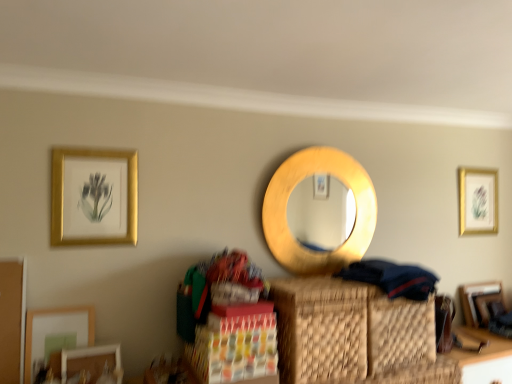
Question: Does dark blue fabric at lower right have a lesser width compared to woven brown basket at center?

Choices:
 (A) no
 (B) yes

Answer: (A)

Question: Considering the relative sizes of dark blue fabric at lower right and woven brown basket at center in the image provided, is dark blue fabric at lower right shorter than woven brown basket at center?

Choices:
 (A) no
 (B) yes

Answer: (B)

Question: From the image's perspective, does dark blue fabric at lower right appear lower than woven brown basket at center?

Choices:
 (A) no
 (B) yes

Answer: (A)

Question: Can woven brown basket at center be found inside dark blue fabric at lower right?

Choices:
 (A) yes
 (B) no

Answer: (B)

Question: Can you confirm if dark blue fabric at lower right is taller than woven brown basket at center?

Choices:
 (A) yes
 (B) no

Answer: (B)

Question: Is dark blue fabric at lower right looking in the opposite direction of woven brown basket at center?

Choices:
 (A) yes
 (B) no

Answer: (B)

Question: From a real-world perspective, is wooden table at lower right physically above matte gold picture frame at lower left, the second picture frame positioned from the front?

Choices:
 (A) no
 (B) yes

Answer: (A)

Question: Is wooden table at lower right wider than matte gold picture frame at lower left, the fourth picture frame when ordered from back to front?

Choices:
 (A) yes
 (B) no

Answer: (A)

Question: From the image's perspective, is wooden table at lower right above matte gold picture frame at lower left, the 5th picture frame positioned from the right?

Choices:
 (A) no
 (B) yes

Answer: (A)

Question: Are wooden table at lower right and matte gold picture frame at lower left, the second picture frame positioned from the front, beside each other?

Choices:
 (A) yes
 (B) no

Answer: (B)

Question: Can you confirm if wooden table at lower right is bigger than matte gold picture frame at lower left, which is the first picture frame in left-to-right order?

Choices:
 (A) no
 (B) yes

Answer: (B)

Question: From the image's perspective, is wooden table at lower right located beneath matte gold picture frame at lower left, the 5th picture frame positioned from the right?

Choices:
 (A) no
 (B) yes

Answer: (B)

Question: From the image's perspective, is woven brown basket at center under matte white picture frame at lower left, arranged as the first picture frame when viewed from the front?

Choices:
 (A) no
 (B) yes

Answer: (A)